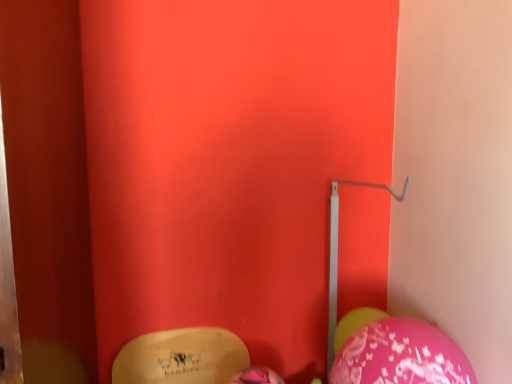
Question: Does pink glossy balloon at lower right, which appears as the 1th balloon when viewed from the left, have a smaller size compared to metallic silver trim at center-right?

Choices:
 (A) yes
 (B) no

Answer: (A)

Question: Is there a large distance between pink glossy balloon at lower right, which appears as the 1th balloon when viewed from the left, and metallic silver trim at center-right?

Choices:
 (A) no
 (B) yes

Answer: (A)

Question: Considering the relative positions of pink glossy balloon at lower right, which appears as the 1th balloon when viewed from the left, and metallic silver trim at center-right in the image provided, is pink glossy balloon at lower right, which appears as the 1th balloon when viewed from the left, to the left of metallic silver trim at center-right from the viewer's perspective?

Choices:
 (A) no
 (B) yes

Answer: (B)

Question: Is pink glossy balloon at lower right, the 1th balloon viewed from the front, touching metallic silver trim at center-right?

Choices:
 (A) no
 (B) yes

Answer: (A)

Question: Is pink glossy balloon at lower right, the 2th balloon positioned from the right, taller than metallic silver trim at center-right?

Choices:
 (A) yes
 (B) no

Answer: (B)

Question: Looking at their shapes, would you say metallic silver trim at center-right is wider or thinner than pink glossy balloon at lower right, which ranks as the first balloon in right-to-left order?

Choices:
 (A) thin
 (B) wide

Answer: (B)

Question: Is metallic silver trim at center-right in front of or behind pink glossy balloon at lower right, positioned as the 2th balloon in front-to-back order, in the image?

Choices:
 (A) behind
 (B) front

Answer: (B)

Question: Looking at the image, does metallic silver trim at center-right seem bigger or smaller compared to pink glossy balloon at lower right, positioned as the 2th balloon in front-to-back order?

Choices:
 (A) small
 (B) big

Answer: (B)

Question: From the image's perspective, is metallic silver trim at center-right located above or below pink glossy balloon at lower right, which ranks as the first balloon in right-to-left order?

Choices:
 (A) below
 (B) above

Answer: (B)

Question: Is pink glossy balloon at lower right, acting as the 1th balloon starting from the back, in front of or behind metallic silver trim at center-right in the image?

Choices:
 (A) behind
 (B) front

Answer: (A)

Question: From a real-world perspective, relative to metallic silver trim at center-right, is pink glossy balloon at lower right, which ranks as the first balloon in right-to-left order, vertically above or below?

Choices:
 (A) above
 (B) below

Answer: (B)

Question: From their relative heights in the image, would you say pink glossy balloon at lower right, positioned as the 2th balloon in front-to-back order, is taller or shorter than metallic silver trim at center-right?

Choices:
 (A) tall
 (B) short

Answer: (B)

Question: Would you say pink glossy balloon at lower right, acting as the 1th balloon starting from the back, is to the left or to the right of metallic silver trim at center-right in the picture?

Choices:
 (A) right
 (B) left

Answer: (A)

Question: From a real-world perspective, is metallic silver trim at center-right physically located above or below pink glossy balloon at lower right, the 2th balloon positioned from the right?

Choices:
 (A) above
 (B) below

Answer: (A)

Question: Looking at the image, does metallic silver trim at center-right seem bigger or smaller compared to pink glossy balloon at lower right, the 1th balloon viewed from the front?

Choices:
 (A) big
 (B) small

Answer: (A)